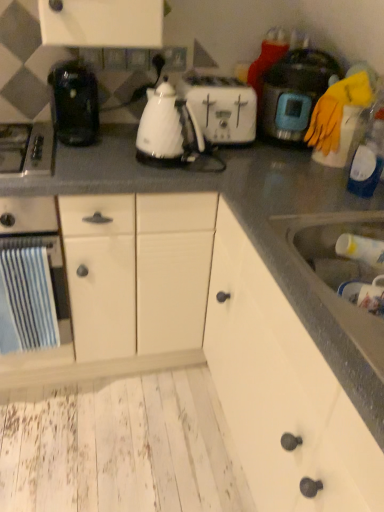
The width and height of the screenshot is (384, 512). Describe the element at coordinates (282, 390) in the screenshot. I see `white matte cabinet at lower right, the first cabinetry positioned from the front` at that location.

Describe the element at coordinates (168, 127) in the screenshot. The image size is (384, 512). I see `white glossy electric kettle at center, which ranks as the second kitchen appliance in left-to-right order` at that location.

Find the location of `matte black rice cooker at upper right, the 3th kitchen appliance viewed from the left`. matte black rice cooker at upper right, the 3th kitchen appliance viewed from the left is located at coordinates (294, 92).

Measure the distance between satin silver gas stove at left and camera.

They are 1.25 meters apart.

This screenshot has width=384, height=512. Identify the location of white matte cabinet at lower right, the first cabinetry positioned from the front. (282, 390).

Looking at this image, is matte black rice cooker at upper right, which ranks as the first kitchen appliance in right-to-left order, to the left or to the right of white glossy electric kettle at center, which ranks as the second kitchen appliance in left-to-right order, in the image?

matte black rice cooker at upper right, which ranks as the first kitchen appliance in right-to-left order, is to the right of white glossy electric kettle at center, which ranks as the second kitchen appliance in left-to-right order.

From the image's perspective, is matte black rice cooker at upper right, which ranks as the first kitchen appliance in right-to-left order, on white glossy electric kettle at center, positioned as the second kitchen appliance in right-to-left order?

Indeed, from the image's perspective, matte black rice cooker at upper right, which ranks as the first kitchen appliance in right-to-left order, is shown above white glossy electric kettle at center, positioned as the second kitchen appliance in right-to-left order.

Is matte black rice cooker at upper right, the 3th kitchen appliance viewed from the left, smaller than white glossy electric kettle at center, which ranks as the second kitchen appliance in left-to-right order?

Actually, matte black rice cooker at upper right, the 3th kitchen appliance viewed from the left, might be larger than white glossy electric kettle at center, which ranks as the second kitchen appliance in left-to-right order.

Considering the positions of points (299, 48) and (158, 91), is point (299, 48) farther from camera compared to point (158, 91)?

That is True.

Which is less distant, (366, 173) or (302, 369)?

Point (366, 173) appears to be farther away from the viewer than point (302, 369).

From a real-world perspective, is transparent plastic bottle at right, arranged as the 1th bottle when viewed from the top, over white matte cabinet at lower right, the first cabinetry positioned from the front?

Yes, from a real-world perspective, transparent plastic bottle at right, arranged as the 1th bottle when viewed from the top, is on top of white matte cabinet at lower right, the first cabinetry positioned from the front.

Does transparent plastic bottle at right, which appears as the second bottle when ordered from the bottom, have a greater width compared to white matte cabinet at lower right, the first cabinetry positioned from the front?

Incorrect, the width of transparent plastic bottle at right, which appears as the second bottle when ordered from the bottom, does not surpass that of white matte cabinet at lower right, the first cabinetry positioned from the front.

Which of these two, transparent plastic bottle at right, arranged as the 1th bottle when viewed from the top, or white matte cabinet at lower right, arranged as the 2th cabinetry when viewed from the back, is smaller?

transparent plastic bottle at right, arranged as the 1th bottle when viewed from the top.

Considering the relative sizes of blue striped towel at left, marked as the third kitchen appliance in a right-to-left arrangement, and matte black rice cooker at upper right, which ranks as the first kitchen appliance in right-to-left order, in the image provided, is blue striped towel at left, marked as the third kitchen appliance in a right-to-left arrangement, wider than matte black rice cooker at upper right, which ranks as the first kitchen appliance in right-to-left order,?

Correct, the width of blue striped towel at left, marked as the third kitchen appliance in a right-to-left arrangement, exceeds that of matte black rice cooker at upper right, which ranks as the first kitchen appliance in right-to-left order.

From a real-world perspective, does blue striped towel at left, marked as the third kitchen appliance in a right-to-left arrangement, stand above matte black rice cooker at upper right, which ranks as the first kitchen appliance in right-to-left order?

No, from a real-world perspective, blue striped towel at left, marked as the third kitchen appliance in a right-to-left arrangement, is not over matte black rice cooker at upper right, which ranks as the first kitchen appliance in right-to-left order

From the image's perspective, relative to matte black rice cooker at upper right, which ranks as the first kitchen appliance in right-to-left order, is blue striped towel at left, the 1th kitchen appliance positioned from the left, above or below?

Clearly, from the image's perspective, blue striped towel at left, the 1th kitchen appliance positioned from the left, is below matte black rice cooker at upper right, which ranks as the first kitchen appliance in right-to-left order.

Is blue striped towel at left, the 1th kitchen appliance positioned from the left, surrounding matte black rice cooker at upper right, the 3th kitchen appliance viewed from the left?

No.

Considering the relative sizes of satin silver gas stove at left and white matte cabinet at lower right, the first cabinetry positioned from the front, in the image provided, is satin silver gas stove at left taller than white matte cabinet at lower right, the first cabinetry positioned from the front,?

No.

Considering the positions of objects satin silver gas stove at left and white matte cabinet at lower right, arranged as the 2th cabinetry when viewed from the back, in the image provided, who is more to the right, satin silver gas stove at left or white matte cabinet at lower right, arranged as the 2th cabinetry when viewed from the back,?

Positioned to the right is white matte cabinet at lower right, arranged as the 2th cabinetry when viewed from the back.

From the picture: Which object is further away from the camera, satin silver gas stove at left or white matte cabinet at lower right, the first cabinetry positioned from the front?

satin silver gas stove at left is further from the camera.

Considering the sizes of objects satin silver gas stove at left and white matte cabinet at lower right, arranged as the 2th cabinetry when viewed from the back, in the image provided, who is smaller, satin silver gas stove at left or white matte cabinet at lower right, arranged as the 2th cabinetry when viewed from the back,?

satin silver gas stove at left is smaller.

What's the angular difference between white matte cabinet at lower right, the first cabinetry positioned from the front, and white matte cabinet at center, acting as the first cabinetry starting from the back,'s facing directions?

90.3 degrees separate the facing orientations of white matte cabinet at lower right, the first cabinetry positioned from the front, and white matte cabinet at center, acting as the first cabinetry starting from the back.

Which object is thinner, white matte cabinet at lower right, arranged as the 2th cabinetry when viewed from the back, or white matte cabinet at center, arranged as the second cabinetry when viewed from the front?

white matte cabinet at lower right, arranged as the 2th cabinetry when viewed from the back, is thinner.

Considering the relative sizes of white matte cabinet at lower right, arranged as the 2th cabinetry when viewed from the back, and white matte cabinet at center, arranged as the second cabinetry when viewed from the front, in the image provided, is white matte cabinet at lower right, arranged as the 2th cabinetry when viewed from the back, shorter than white matte cabinet at center, arranged as the second cabinetry when viewed from the front,?

Yes.

Is white matte cabinet at lower right, the first cabinetry positioned from the front, looking in the opposite direction of white matte cabinet at center, acting as the first cabinetry starting from the back?

No, white matte cabinet at lower right, the first cabinetry positioned from the front,'s orientation is not away from white matte cabinet at center, acting as the first cabinetry starting from the back.

Considering the relative sizes of matte black rice cooker at upper right, which ranks as the first kitchen appliance in right-to-left order, and white plastic toaster at center in the image provided, is matte black rice cooker at upper right, which ranks as the first kitchen appliance in right-to-left order, taller than white plastic toaster at center?

Yes.

From the image's perspective, is matte black rice cooker at upper right, which ranks as the first kitchen appliance in right-to-left order, located above or below white plastic toaster at center?

Clearly, from the image's perspective, matte black rice cooker at upper right, which ranks as the first kitchen appliance in right-to-left order, is above white plastic toaster at center.

Does matte black rice cooker at upper right, the 3th kitchen appliance viewed from the left, appear on the left side of white plastic toaster at center?

No.

Is the position of white matte cabinet at lower right, the first cabinetry positioned from the front, less distant than that of transparent plastic bottle at right, which appears as the second bottle when ordered from the bottom?

Yes, it is.

Would you consider white matte cabinet at lower right, arranged as the 2th cabinetry when viewed from the back, to be distant from transparent plastic bottle at right, which appears as the second bottle when ordered from the bottom?

That's not correct — white matte cabinet at lower right, arranged as the 2th cabinetry when viewed from the back, is a little close to transparent plastic bottle at right, which appears as the second bottle when ordered from the bottom.

Is point (261, 412) closer or farther from the camera than point (368, 185)?

Point (261, 412) is closer to the camera than point (368, 185).

From a real-world perspective, count 1st kitchen appliances downward from the matte black rice cooker at upper right, which ranks as the first kitchen appliance in right-to-left order, and point to it. Please provide its 2D coordinates.

[(168, 127)]

Which cabinetry is the 1st one when counting from the left side of the transparent plastic bottle at right, which appears as the second bottle when ordered from the bottom? Please provide its 2D coordinates.

[(282, 390)]

Looking at the image, which one is located further to white plastic toaster at center, white plastic bottle at sink, the second bottle viewed from the top, or blue striped towel at left, marked as the third kitchen appliance in a right-to-left arrangement?

Based on the image, blue striped towel at left, marked as the third kitchen appliance in a right-to-left arrangement, appears to be further to white plastic toaster at center.

Looking at the image, which one is located closer to blue striped towel at left, marked as the third kitchen appliance in a right-to-left arrangement, white plastic toaster at center or satin silver gas stove at left?

satin silver gas stove at left lies closer to blue striped towel at left, marked as the third kitchen appliance in a right-to-left arrangement, than the other object.

In the scene shown: From the image, which object appears to be farther from white matte cabinet at center, arranged as the second cabinetry when viewed from the front, matte black rice cooker at upper right, which ranks as the first kitchen appliance in right-to-left order, or white glossy electric kettle at center, positioned as the second kitchen appliance in right-to-left order?

matte black rice cooker at upper right, which ranks as the first kitchen appliance in right-to-left order, is further to white matte cabinet at center, arranged as the second cabinetry when viewed from the front.

Looking at the image, which one is located further to white glossy electric kettle at center, which ranks as the second kitchen appliance in left-to-right order, white matte cabinet at center, acting as the first cabinetry starting from the back, or white matte cabinet at lower right, arranged as the 2th cabinetry when viewed from the back?

Based on the image, white matte cabinet at center, acting as the first cabinetry starting from the back, appears to be further to white glossy electric kettle at center, which ranks as the second kitchen appliance in left-to-right order.

From the image, which object appears to be farther from blue striped towel at left, the 1th kitchen appliance positioned from the left, transparent plastic bottle at right, which appears as the second bottle when ordered from the bottom, or matte black rice cooker at upper right, the 3th kitchen appliance viewed from the left?

Answer: Based on the image, transparent plastic bottle at right, which appears as the second bottle when ordered from the bottom, appears to be further to blue striped towel at left, the 1th kitchen appliance positioned from the left.

Based on their spatial positions, is white plastic bottle at sink, the 1th bottle when ordered from bottom to top, or white matte cabinet at center, acting as the first cabinetry starting from the back, further from blue striped towel at left, the 1th kitchen appliance positioned from the left?

white plastic bottle at sink, the 1th bottle when ordered from bottom to top, lies further to blue striped towel at left, the 1th kitchen appliance positioned from the left, than the other object.

From the image, which object appears to be farther from white matte cabinet at center, arranged as the second cabinetry when viewed from the front, white glossy electric kettle at center, positioned as the second kitchen appliance in right-to-left order, or white plastic bottle at sink, the 1th bottle when ordered from bottom to top?

The object further to white matte cabinet at center, arranged as the second cabinetry when viewed from the front, is white plastic bottle at sink, the 1th bottle when ordered from bottom to top.

When comparing their distances from white plastic toaster at center, does white glossy electric kettle at center, which ranks as the second kitchen appliance in left-to-right order, or blue striped towel at left, the 1th kitchen appliance positioned from the left, seem further?

The object further to white plastic toaster at center is blue striped towel at left, the 1th kitchen appliance positioned from the left.

The height and width of the screenshot is (512, 384). I want to click on toaster situated between blue striped towel at left, the 1th kitchen appliance positioned from the left, and white matte cabinet at lower right, the first cabinetry positioned from the front, from left to right, so click(x=221, y=106).

Find the location of `kitchen appliance between blue striped towel at left, marked as the third kitchen appliance in a right-to-left arrangement, and white plastic toaster at center, in the horizontal direction`. kitchen appliance between blue striped towel at left, marked as the third kitchen appliance in a right-to-left arrangement, and white plastic toaster at center, in the horizontal direction is located at coordinates (168, 127).

In order to click on toaster between matte black rice cooker at upper right, which ranks as the first kitchen appliance in right-to-left order, and white matte cabinet at center, arranged as the second cabinetry when viewed from the front, from top to bottom in this screenshot , I will do `click(221, 106)`.

Locate an element on the screen. toaster located between blue striped towel at left, the 1th kitchen appliance positioned from the left, and white plastic bottle at sink, the 1th bottle when ordered from bottom to top, in the left-right direction is located at coordinates (221, 106).